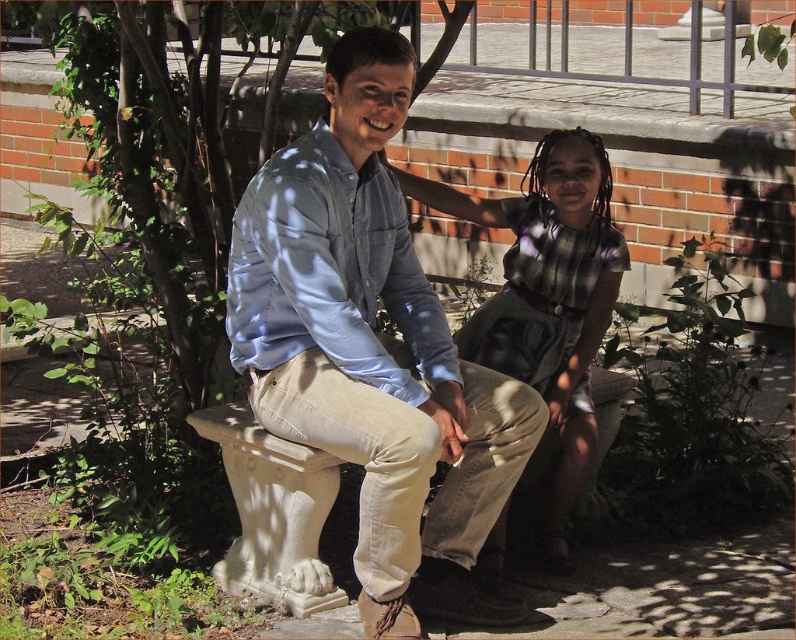
Between light blue denim shirt at center and matte blue shirt at center, which one appears on the left side from the viewer's perspective?

Positioned to the left is light blue denim shirt at center.

Does light blue denim shirt at center have a smaller size compared to matte blue shirt at center?

Incorrect, light blue denim shirt at center is not smaller in size than matte blue shirt at center.

Find the location of `light blue denim shirt at center`. light blue denim shirt at center is located at coordinates (373, 352).

Where is `light blue denim shirt at center`? The image size is (796, 640). light blue denim shirt at center is located at coordinates (373, 352).